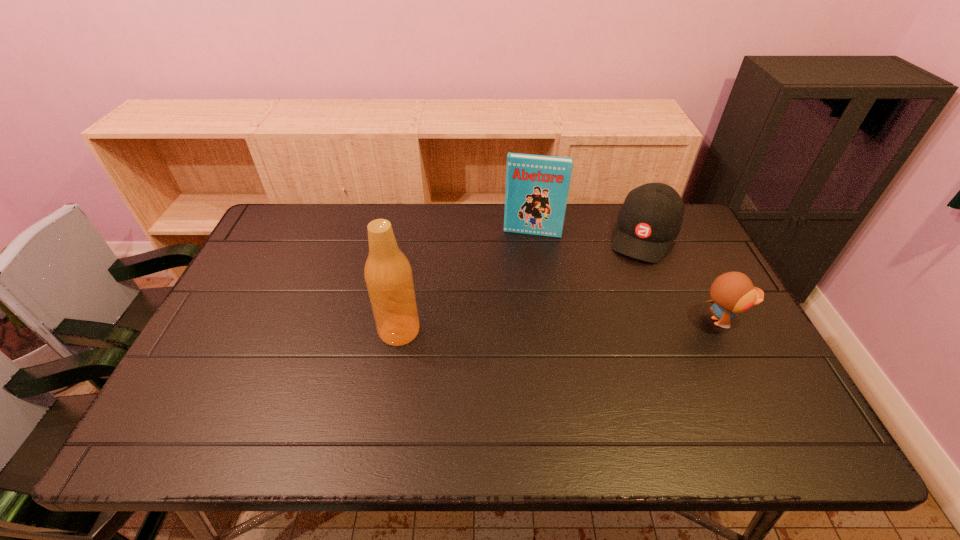
At what (x,y) coordinates should I click in order to perform the action: click on vacant spot on the desktop that is between the tallest object and the duck and is positioned on the front cover of the third object from right to left. Please return your answer as a coordinate pair (x, y). Image resolution: width=960 pixels, height=540 pixels. Looking at the image, I should click on (518, 327).

The height and width of the screenshot is (540, 960). Find the location of `vacant space on the desktop that is between the leftmost object and the duck and is positioned with a logo on the front of the baseball cap`. vacant space on the desktop that is between the leftmost object and the duck and is positioned with a logo on the front of the baseball cap is located at coordinates (604, 325).